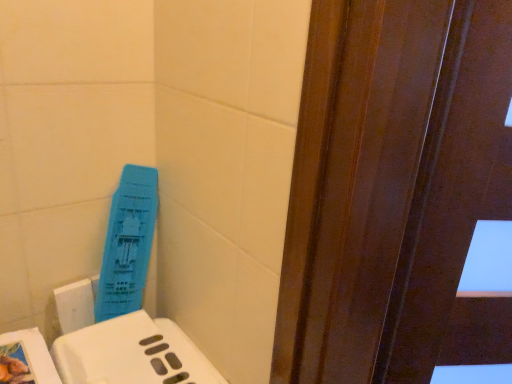
Describe the element at coordinates (127, 243) in the screenshot. The width and height of the screenshot is (512, 384). I see `blue plastic cleaning product at left` at that location.

Where is `blue plastic cleaning product at left`? blue plastic cleaning product at left is located at coordinates tap(127, 243).

You are a GUI agent. You are given a task and a screenshot of the screen. Output one action in this format:
    pyautogui.click(x=<x>, y=<y>)
    Task: Click on the blue plastic cleaning product at left
    This screenshot has height=384, width=512.
    Given the screenshot: What is the action you would take?
    pyautogui.click(x=127, y=243)